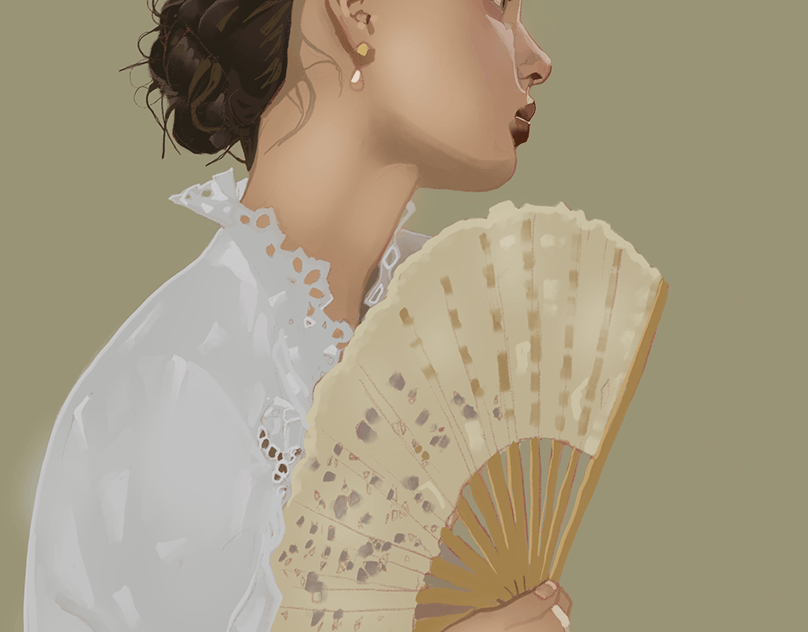
Locate an element on the screen. This screenshot has width=808, height=632. fan is located at coordinates (457, 402).